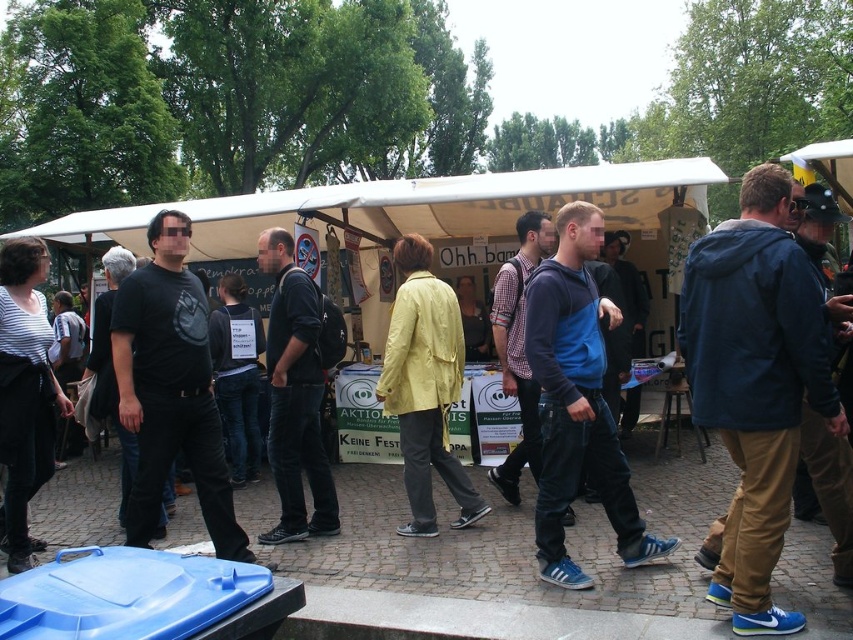
Question: Which point appears closest to the camera in this image?

Choices:
 (A) (506, 282)
 (B) (136, 292)
 (C) (625, 554)
 (D) (308, 280)

Answer: (B)

Question: Estimate the real-world distances between objects in this image. Which object is closer to the matte black t-shirt at center?

Choices:
 (A) dark blue leather jacket at center
 (B) blue fleece jacket at center
 (C) matte blue jacket at center

Answer: (A)

Question: Is blue fabric jacket at right positioned in front of dark blue leather jacket at center?

Choices:
 (A) yes
 (B) no

Answer: (A)

Question: Estimate the real-world distances between objects in this image. Which object is closer to the blue fleece jacket at center?

Choices:
 (A) matte blue jacket at center
 (B) matte black t-shirt at center
 (C) blue fabric jacket at right
 (D) dark blue leather jacket at center

Answer: (C)

Question: Can you confirm if blue fabric jacket at right is positioned to the left of matte black t-shirt at center?

Choices:
 (A) yes
 (B) no

Answer: (B)

Question: Does blue fabric jacket at right appear over matte black t-shirt at center?

Choices:
 (A) yes
 (B) no

Answer: (A)